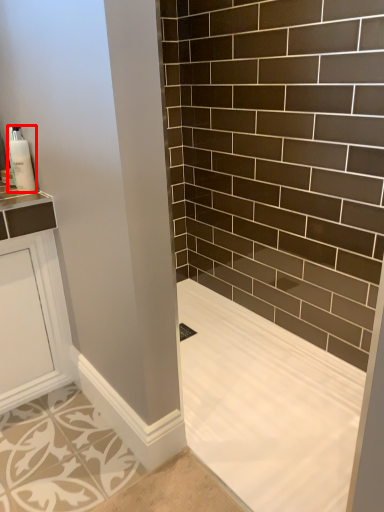
Question: From the image's perspective, where is soap dispenser (annotated by the red box) located in relation to bath in the image?

Choices:
 (A) below
 (B) above

Answer: (B)